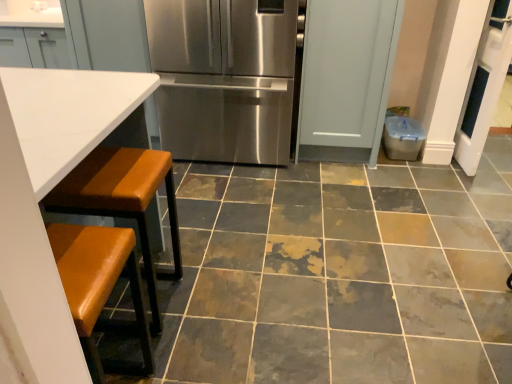
The height and width of the screenshot is (384, 512). In order to click on vacant area that lies between brown leather stool at lower left and stainless steel refrigerator at center in this screenshot , I will do `click(214, 214)`.